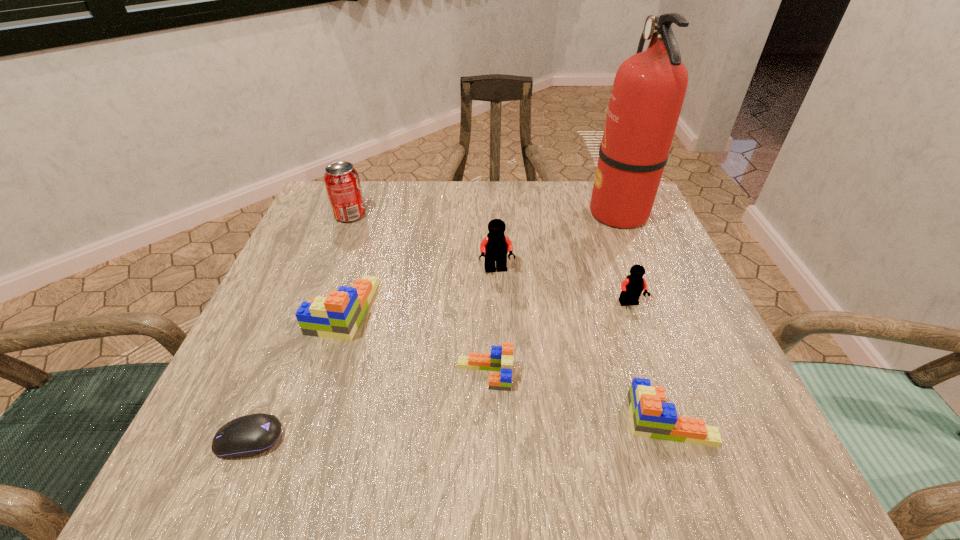
The height and width of the screenshot is (540, 960). I want to click on vacant position in the image that satisfies the following two spatial constraints: 1. on the front-facing side of the second smallest orange Lego; 2. on the left side of the left black Lego, so click(503, 420).

This screenshot has height=540, width=960. I want to click on free space in the image that satisfies the following two spatial constraints: 1. on the back side of the second orange Lego from left to right; 2. on the right side of the black computer mouse, so click(276, 375).

Identify the location of vacant area that satisfies the following two spatial constraints: 1. on the front-facing side of the rightmost orange Lego; 2. on the left side of the left black Lego. (503, 420).